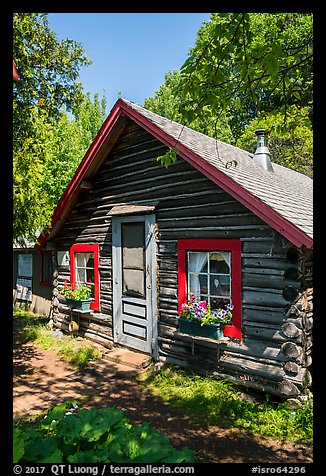
Where is `dark teal window planter box`? dark teal window planter box is located at coordinates (207, 332).